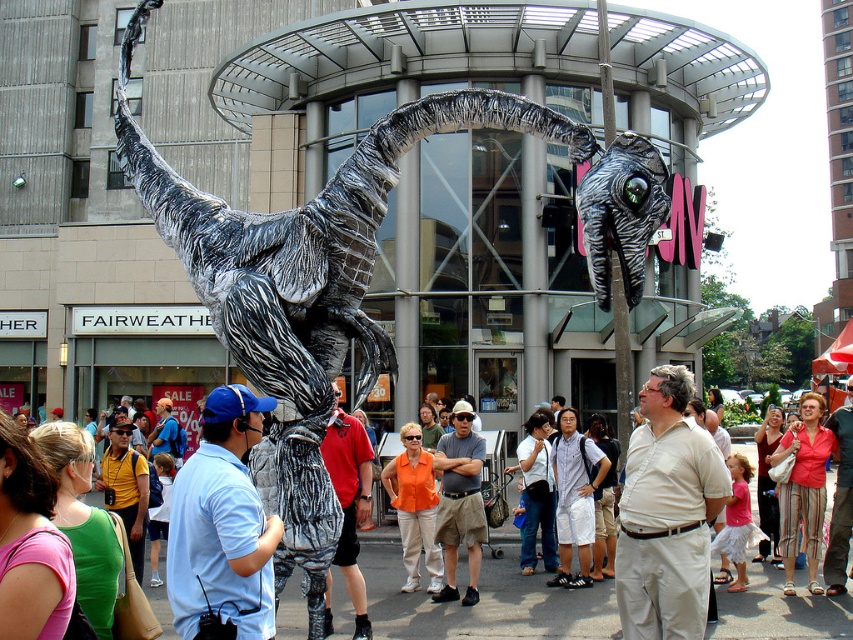
Question: Is silver metallic dinosaur at center to the right of khaki shorts at center from the viewer's perspective?

Choices:
 (A) yes
 (B) no

Answer: (B)

Question: Among these objects, which one is farthest from the camera?

Choices:
 (A) matte red shirt at center
 (B) matte black statue at center
 (C) shiny metallic alien at center
 (D) khaki shorts at center

Answer: (D)

Question: Which of these objects is positioned farthest from the shiny metallic alien at center?

Choices:
 (A) white cotton shirt at center
 (B) khaki shorts at center
 (C) silver metallic dinosaur at center
 (D) light blue shirt at center

Answer: (B)

Question: Considering the real-world distances, which object is closest to the silver metallic dinosaur at center?

Choices:
 (A) white cotton shirt at center
 (B) khaki shorts at center
 (C) matte red shirt at center

Answer: (C)

Question: Does matte black statue at center appear over khaki shorts at center?

Choices:
 (A) no
 (B) yes

Answer: (A)

Question: From the image, what is the correct spatial relationship of matte black statue at center in relation to matte red shirt at center?

Choices:
 (A) above
 (B) below

Answer: (B)